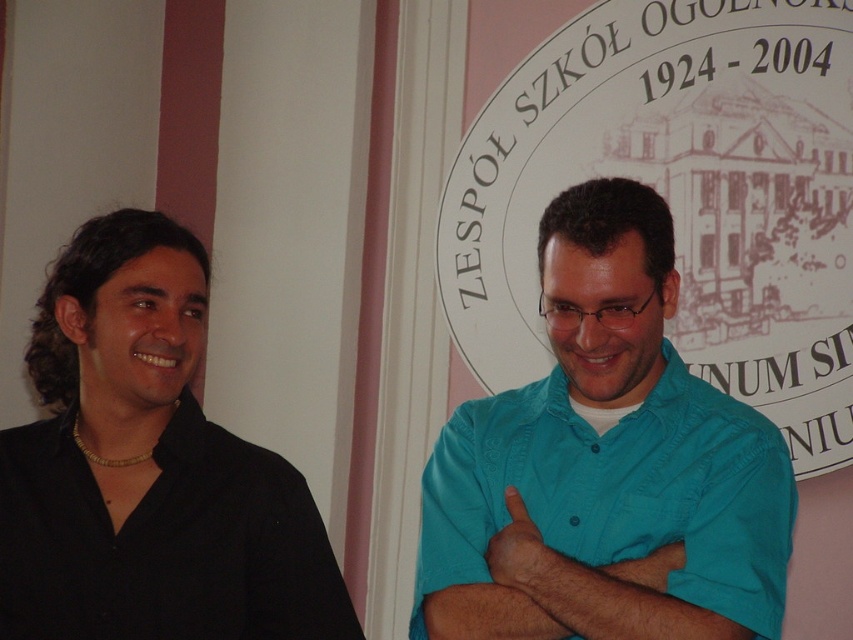
Question: Can you confirm if teal cotton shirt at center is thinner than black matte shirt at left?

Choices:
 (A) yes
 (B) no

Answer: (B)

Question: Is matte black shirt at left below teal cotton shirt at center?

Choices:
 (A) yes
 (B) no

Answer: (B)

Question: Which point is farther to the camera?

Choices:
 (A) teal cotton shirt at center
 (B) matte black shirt at left

Answer: (B)

Question: Which is nearer to the teal cotton shirt at center?

Choices:
 (A) black matte shirt at left
 (B) matte black shirt at left

Answer: (B)

Question: From the image, what is the correct spatial relationship of matte black shirt at left in relation to teal cotton shirt at center?

Choices:
 (A) right
 (B) left

Answer: (B)

Question: Which is farther from the black matte shirt at left?

Choices:
 (A) teal cotton shirt at center
 (B) matte black shirt at left

Answer: (A)